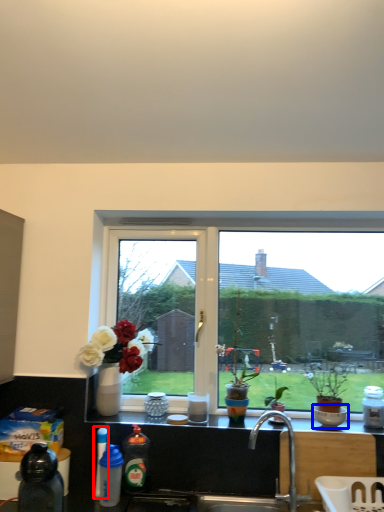
Question: Which object is further to the camera taking this photo, bottle (highlighted by a red box) or bowl (highlighted by a blue box)?

Choices:
 (A) bottle
 (B) bowl

Answer: (B)